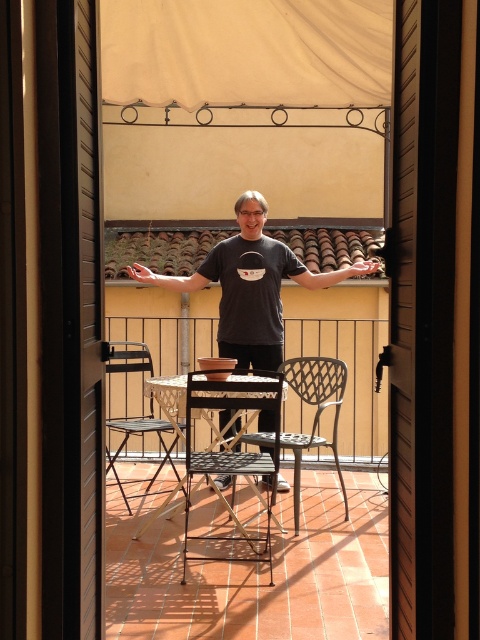
Question: Is matte gray t-shirt at center to the left of matte black arm at upper center from the viewer's perspective?

Choices:
 (A) yes
 (B) no

Answer: (B)

Question: Which of the following is the closest to the observer?

Choices:
 (A) beige fabric canopy at upper center
 (B) matte black arm at upper center

Answer: (A)

Question: Is beige fabric canopy at upper center positioned at the back of metallic black chair at center?

Choices:
 (A) yes
 (B) no

Answer: (B)

Question: Among these objects, which one is farthest from the camera?

Choices:
 (A) matte black hand at upper center
 (B) metallic black chair at center
 (C) metallic silver chair at center
 (D) beige fabric canopy at upper center

Answer: (A)

Question: Which object is closer to the camera taking this photo?

Choices:
 (A) beige fabric canopy at upper center
 (B) metallic black chair at center

Answer: (A)

Question: Is metallic silver chair at center positioned at the back of matte black hand at upper center?

Choices:
 (A) yes
 (B) no

Answer: (B)